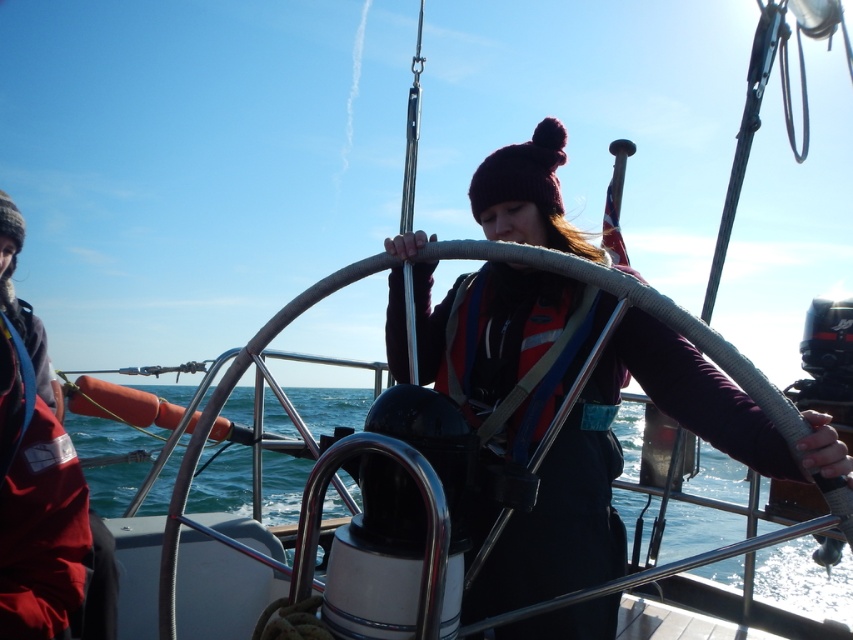
Question: Does matte black life vest at center appear under blue water at center?

Choices:
 (A) no
 (B) yes

Answer: (A)

Question: Does blue water at center appear over red life jacket at center?

Choices:
 (A) yes
 (B) no

Answer: (B)

Question: Does matte black life vest at center have a greater width compared to blue water at center?

Choices:
 (A) no
 (B) yes

Answer: (A)

Question: Among these objects, which one is nearest to the camera?

Choices:
 (A) matte black life vest at center
 (B) blue water at center

Answer: (A)

Question: Which point is closer to the camera?

Choices:
 (A) (547, 292)
 (B) (216, 504)
 (C) (486, 289)

Answer: (A)

Question: Considering the real-world distances, which object is farthest from the matte black life vest at center?

Choices:
 (A) red life jacket at center
 (B) blue water at center

Answer: (B)